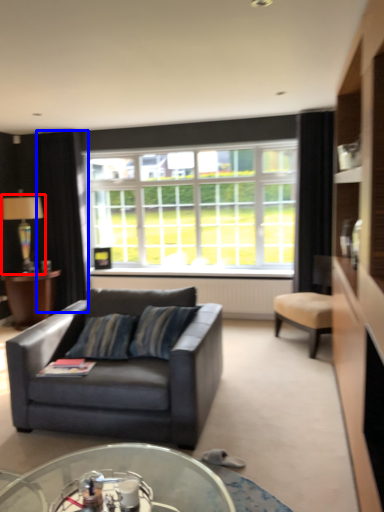
Question: Among these objects, which one is farthest to the camera, lamp (highlighted by a red box) or curtain (highlighted by a blue box)?

Choices:
 (A) lamp
 (B) curtain

Answer: (B)